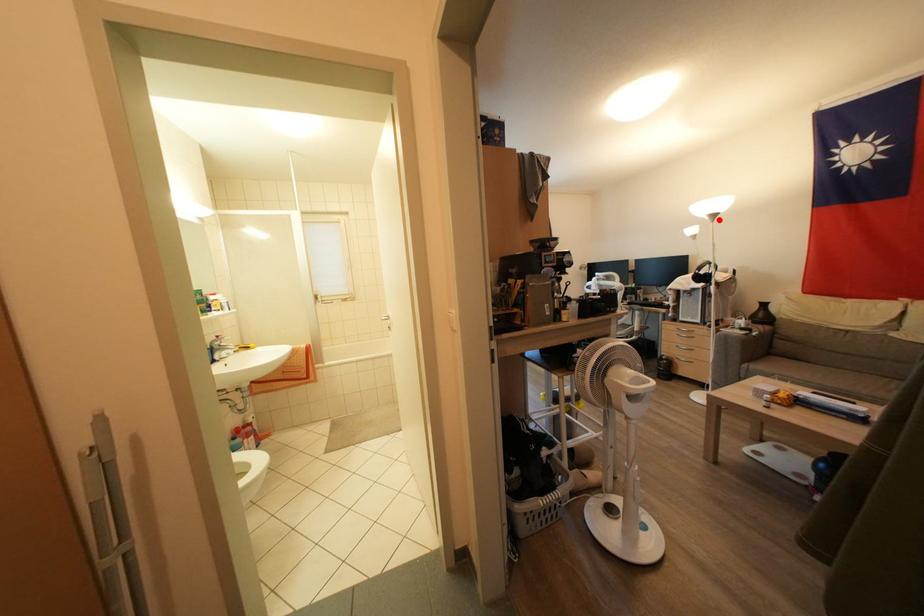
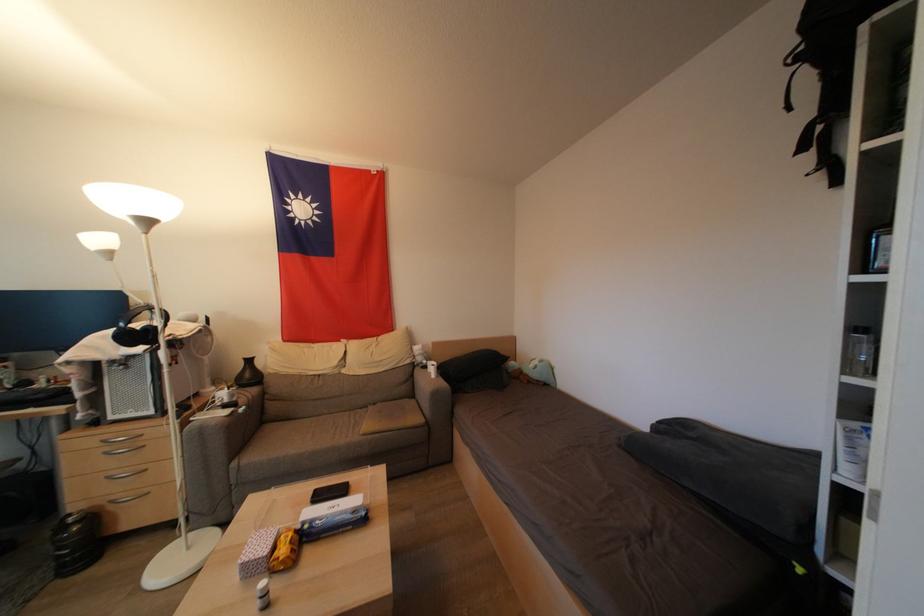
The point at the highlighted location is marked in the first image. Where is the corresponding point in the second image?

(152, 225)